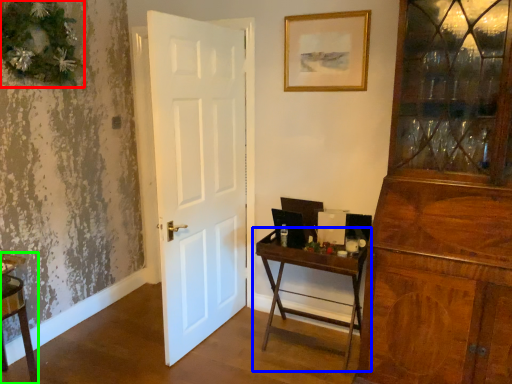
Question: Estimate the real-world distances between objects in this image. Which object is closer to christmas decoration (highlighted by a red box), table (highlighted by a blue box) or vanity (highlighted by a green box)?

Choices:
 (A) table
 (B) vanity

Answer: (B)